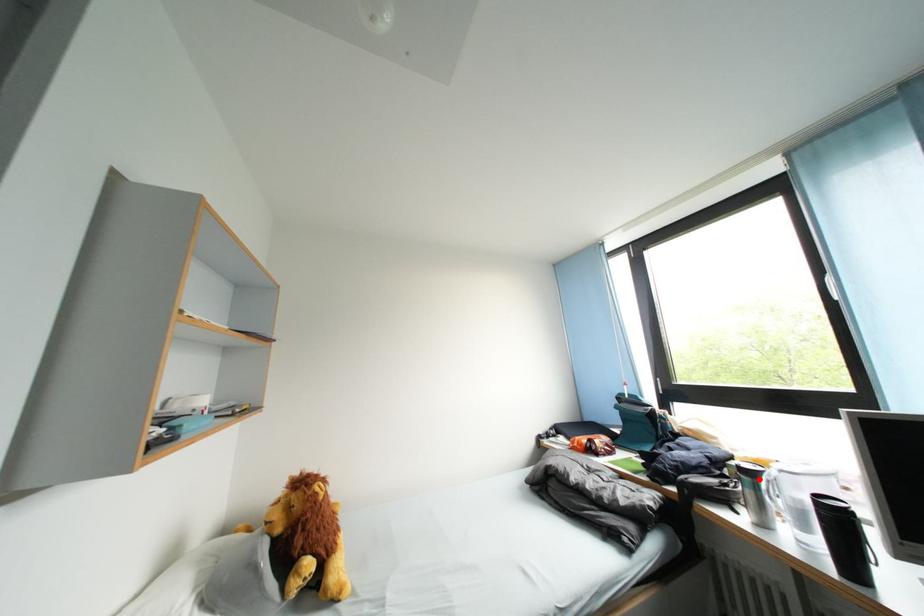
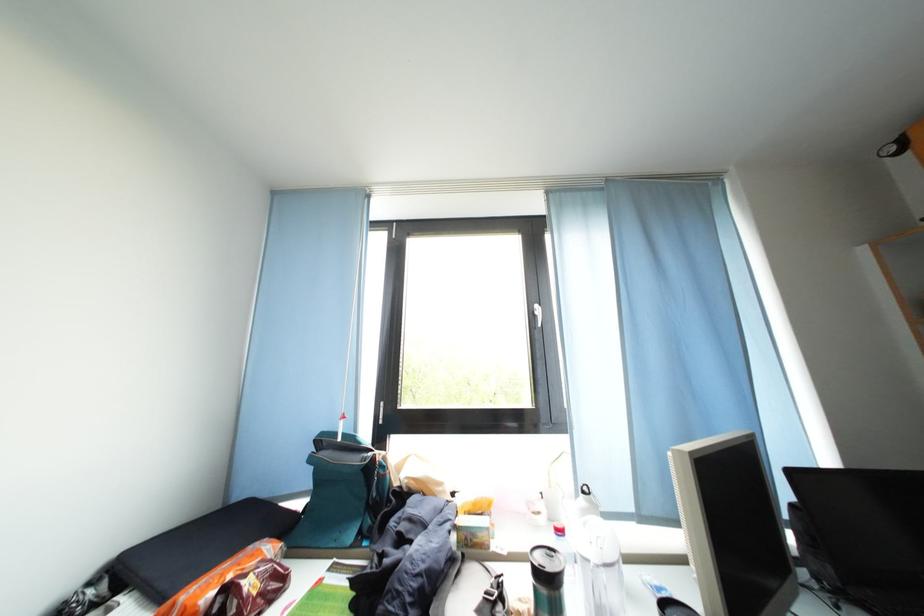
Locate, in the second image, the point that corresponds to the highlighted location in the first image.

(568, 589)